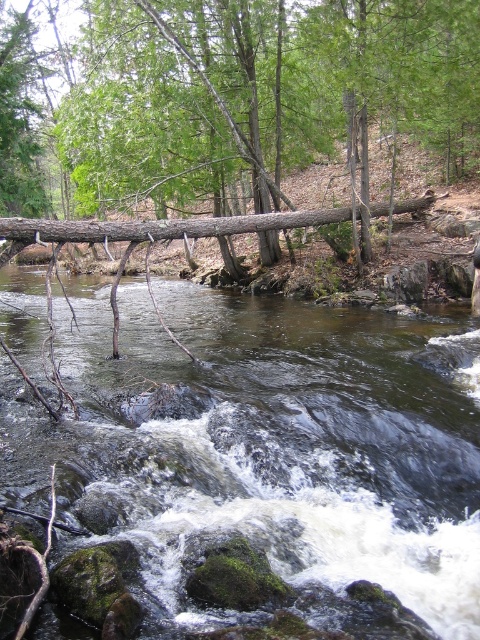
Question: Which object appears farthest from the camera in this image?

Choices:
 (A) dark green mossy rocks at center
 (B) brown rough log at center

Answer: (B)

Question: Which of the following is the farthest from the observer?

Choices:
 (A) dark green mossy rocks at center
 (B) brown rough log at center

Answer: (B)

Question: Does dark green mossy rocks at center have a smaller size compared to brown rough log at center?

Choices:
 (A) no
 (B) yes

Answer: (B)

Question: Does dark green mossy rocks at center have a smaller size compared to brown rough log at center?

Choices:
 (A) no
 (B) yes

Answer: (B)

Question: Is dark green mossy rocks at center smaller than brown rough log at center?

Choices:
 (A) yes
 (B) no

Answer: (A)

Question: Which object is farther from the camera taking this photo?

Choices:
 (A) brown rough log at center
 (B) dark green mossy rocks at center

Answer: (A)